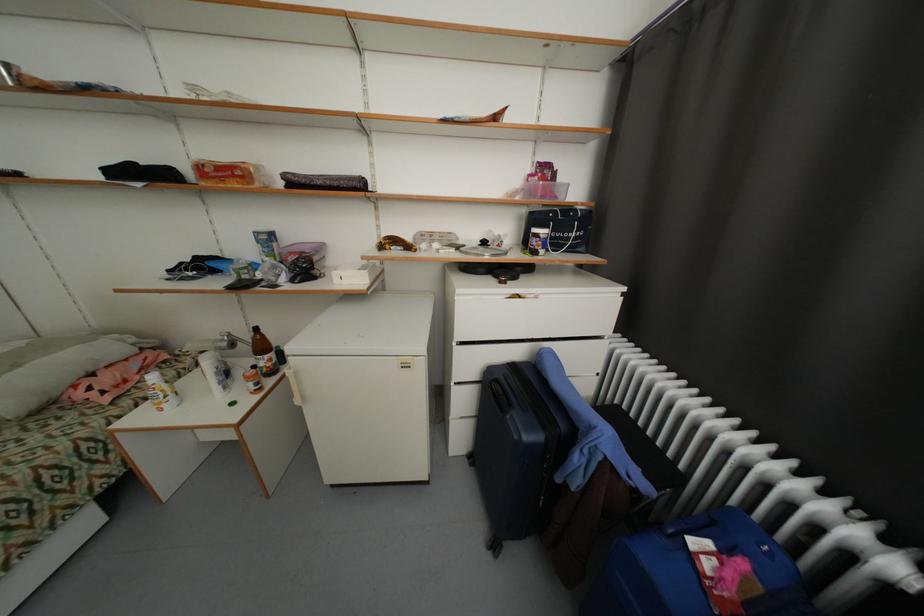
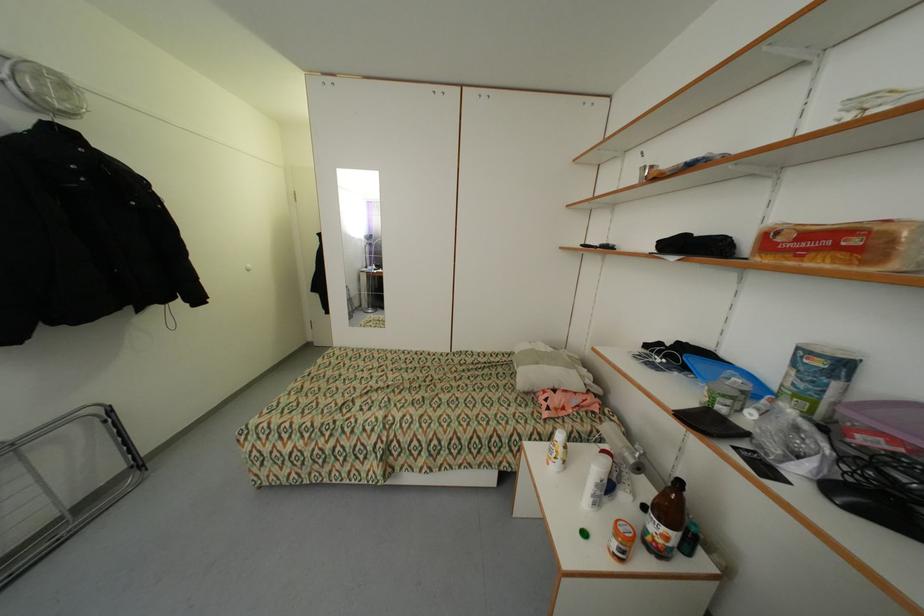
The point at [245,174] is marked in the first image. Where is the corresponding point in the second image?

(860, 241)